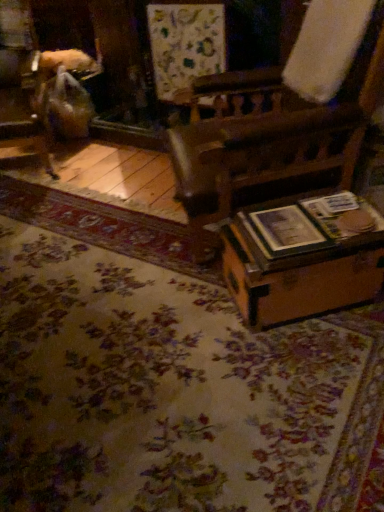
Question: Can you confirm if floral carpet at center is wider than wooden trunk at lower right?

Choices:
 (A) no
 (B) yes

Answer: (B)

Question: Is floral carpet at center shorter than wooden trunk at lower right?

Choices:
 (A) yes
 (B) no

Answer: (A)

Question: Would you say wooden trunk at lower right is part of floral carpet at center's contents?

Choices:
 (A) no
 (B) yes

Answer: (A)

Question: Can you confirm if floral carpet at center is positioned to the left of wooden trunk at lower right?

Choices:
 (A) yes
 (B) no

Answer: (A)

Question: Is the depth of floral carpet at center less than that of wooden trunk at lower right?

Choices:
 (A) yes
 (B) no

Answer: (A)

Question: Considering their positions, is wooden trunk at lower right located in front of or behind wooden chair at left?

Choices:
 (A) behind
 (B) front

Answer: (B)

Question: From a real-world perspective, is wooden trunk at lower right above or below wooden chair at left?

Choices:
 (A) above
 (B) below

Answer: (B)

Question: Is wooden trunk at lower right wider or thinner than wooden chair at left?

Choices:
 (A) thin
 (B) wide

Answer: (A)

Question: From their relative heights in the image, would you say wooden trunk at lower right is taller or shorter than wooden chair at left?

Choices:
 (A) tall
 (B) short

Answer: (B)

Question: Considering their positions, is floral carpet at center located in front of or behind wooden trunk at lower right?

Choices:
 (A) front
 (B) behind

Answer: (A)

Question: Is floral carpet at center inside or outside of wooden trunk at lower right?

Choices:
 (A) outside
 (B) inside

Answer: (A)

Question: Based on their positions, is floral carpet at center located to the left or right of wooden trunk at lower right?

Choices:
 (A) right
 (B) left

Answer: (B)

Question: From a real-world perspective, is floral carpet at center physically located above or below wooden trunk at lower right?

Choices:
 (A) above
 (B) below

Answer: (B)

Question: Is floral carpet at center wider or thinner than wooden chair at left?

Choices:
 (A) wide
 (B) thin

Answer: (A)

Question: From a real-world perspective, is floral carpet at center above or below wooden chair at left?

Choices:
 (A) above
 (B) below

Answer: (B)